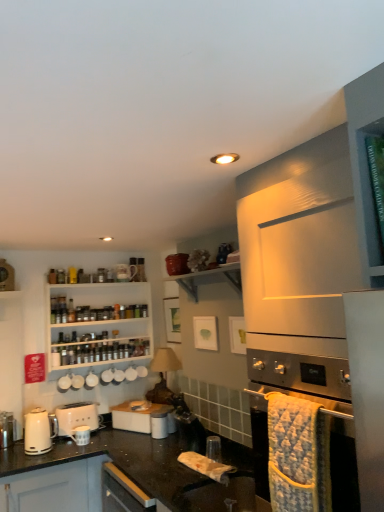
You are a GUI agent. You are given a task and a screenshot of the screen. Output one action in this format:
    pyautogui.click(x=<x>, y=<y>)
    Task: Click on the free space above white wooden shelves at upper left (from a real-world perspective)
    
    Given the screenshot: What is the action you would take?
    pyautogui.click(x=113, y=272)